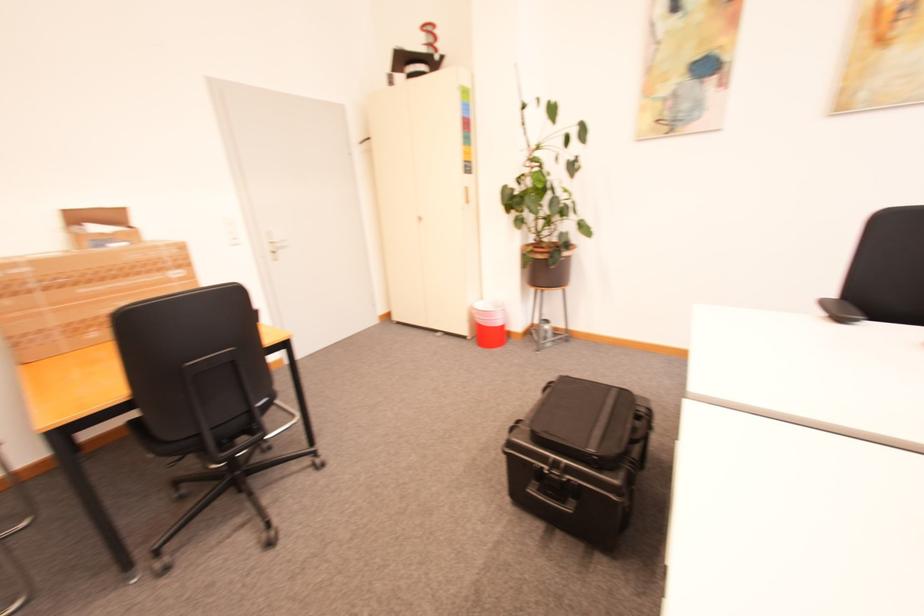
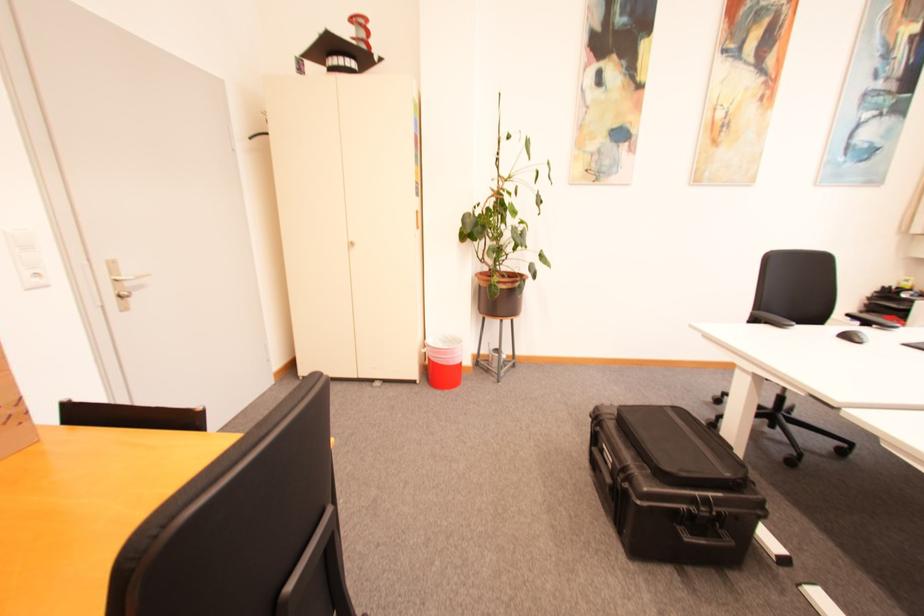
The point at [830,302] is marked in the first image. Where is the corresponding point in the second image?

(759, 315)